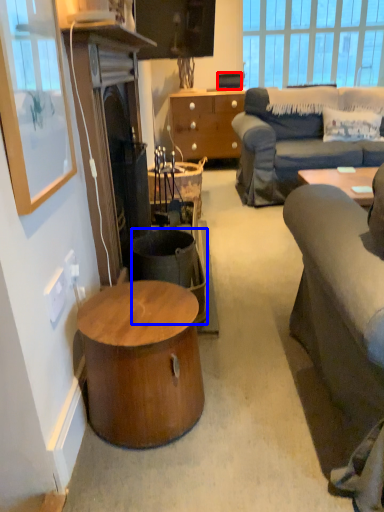
Question: Which object appears farthest to the camera in this image, speaker (highlighted by a red box) or trash bin/can (highlighted by a blue box)?

Choices:
 (A) speaker
 (B) trash bin/can

Answer: (A)